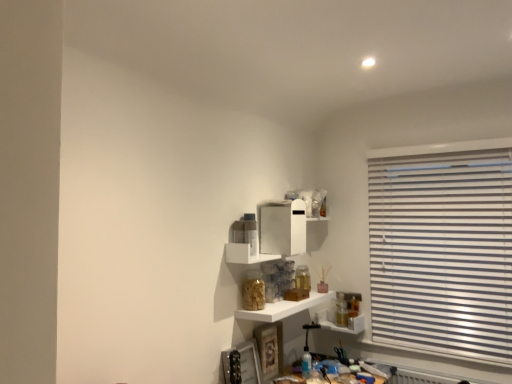
Question: Can we say translucent glass jar at lower right, which appears as the first shelf when ordered from the bottom, lies outside white glossy shelf at center, which is the second shelf from top to bottom?

Choices:
 (A) no
 (B) yes

Answer: (B)

Question: Is translucent glass jar at lower right, which appears as the first shelf when ordered from the bottom, aimed at white glossy shelf at center, the 2th shelf when ordered from bottom to top?

Choices:
 (A) no
 (B) yes

Answer: (A)

Question: From the image's perspective, is translucent glass jar at lower right, which is the 3th shelf in top-to-bottom order, under white glossy shelf at center, the 2th shelf when ordered from bottom to top?

Choices:
 (A) no
 (B) yes

Answer: (B)

Question: Considering the relative sizes of translucent glass jar at lower right, which is the 3th shelf in top-to-bottom order, and white glossy shelf at center, which is the second shelf from top to bottom, in the image provided, is translucent glass jar at lower right, which is the 3th shelf in top-to-bottom order, wider than white glossy shelf at center, which is the second shelf from top to bottom,?

Choices:
 (A) yes
 (B) no

Answer: (B)

Question: Is translucent glass jar at lower right, which is the 3th shelf in top-to-bottom order, smaller than white glossy shelf at center, which is the second shelf from top to bottom?

Choices:
 (A) no
 (B) yes

Answer: (B)

Question: Does translucent glass jar at lower right, which appears as the first shelf when ordered from the bottom, lie behind white glossy shelf at center, which is the second shelf from top to bottom?

Choices:
 (A) yes
 (B) no

Answer: (A)

Question: Is white glossy shelf at center, the 2th shelf when ordered from bottom to top, outside white glossy shelf at center, which ranks as the third shelf in bottom-to-top order?

Choices:
 (A) yes
 (B) no

Answer: (A)

Question: From a real-world perspective, is white glossy shelf at center, the 2th shelf when ordered from bottom to top, physically above white glossy shelf at center, which ranks as the third shelf in bottom-to-top order?

Choices:
 (A) yes
 (B) no

Answer: (B)

Question: From a real-world perspective, does white glossy shelf at center, which is the second shelf from top to bottom, sit lower than white glossy shelf at center, the 1th shelf positioned from the top?

Choices:
 (A) yes
 (B) no

Answer: (A)

Question: Considering the relative sizes of white glossy shelf at center, which is the second shelf from top to bottom, and white glossy shelf at center, the 1th shelf positioned from the top, in the image provided, is white glossy shelf at center, which is the second shelf from top to bottom, thinner than white glossy shelf at center, the 1th shelf positioned from the top,?

Choices:
 (A) no
 (B) yes

Answer: (A)

Question: From the image's perspective, does white glossy shelf at center, the 2th shelf when ordered from bottom to top, appear lower than white glossy shelf at center, the 1th shelf positioned from the top?

Choices:
 (A) yes
 (B) no

Answer: (A)

Question: Would you say white glossy shelf at center, the 1th shelf positioned from the top, is part of white glossy shelf at center, which is the second shelf from top to bottom,'s contents?

Choices:
 (A) yes
 (B) no

Answer: (B)

Question: From a real-world perspective, is translucent glass jar at lower right, which is the 3th shelf in top-to-bottom order, on white glossy shelf at center, the 1th shelf positioned from the top?

Choices:
 (A) yes
 (B) no

Answer: (B)